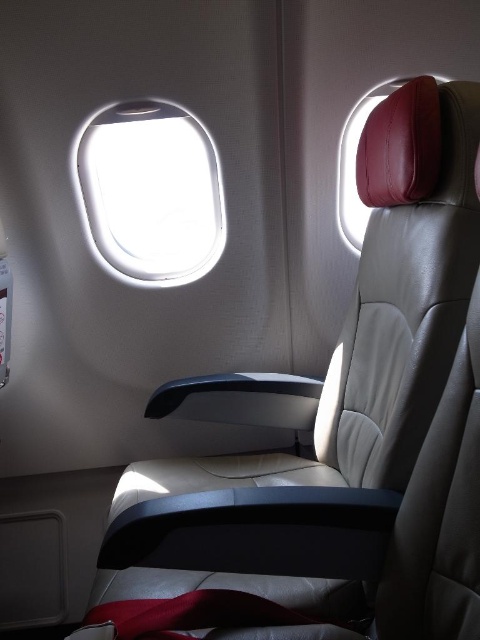
Where is `transparent glass airplane window at upper center`? The image size is (480, 640). transparent glass airplane window at upper center is located at coordinates (149, 193).

Identify the location of transparent glass airplane window at upper center. The image size is (480, 640). (149, 193).

Identify the location of transparent glass airplane window at upper center. This screenshot has width=480, height=640. (149, 193).